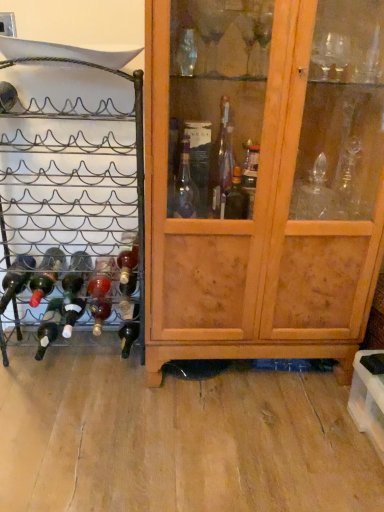
Where is `vacant point to the left of dark glass bottle at lower left, the second bottle in the right-to-left sequence`? The width and height of the screenshot is (384, 512). vacant point to the left of dark glass bottle at lower left, the second bottle in the right-to-left sequence is located at coordinates (101, 352).